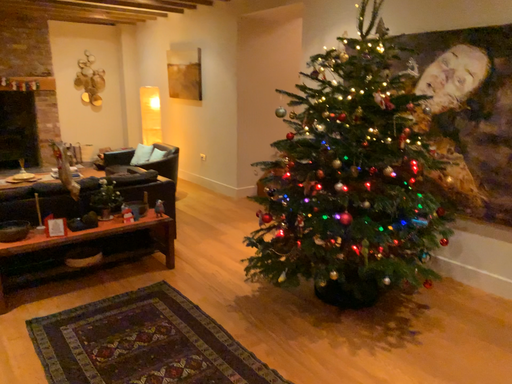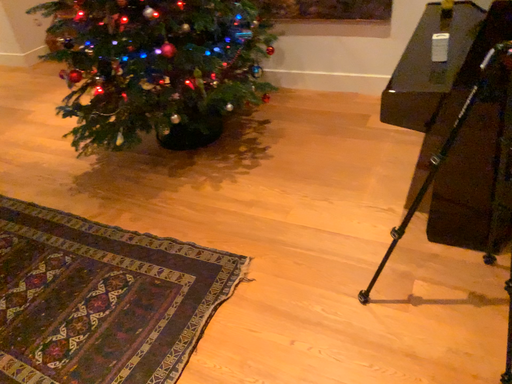
Question: How did the camera likely rotate when shooting the video?

Choices:
 (A) rotated downward
 (B) rotated upward

Answer: (A)